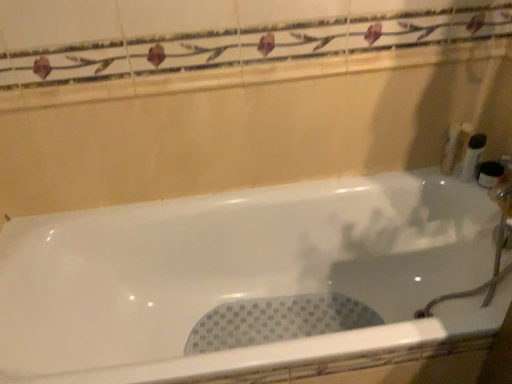
Question: Can we say white plastic container at right, the third toiletry in the right-to-left sequence, lies outside white plastic bottle at right, arranged as the 3th toiletry when viewed from the left?

Choices:
 (A) yes
 (B) no

Answer: (A)

Question: Is the position of white plastic container at right, the third toiletry in the right-to-left sequence, more distant than that of white plastic bottle at right, arranged as the 3th toiletry when viewed from the left?

Choices:
 (A) no
 (B) yes

Answer: (B)

Question: Considering the relative sizes of white plastic container at right, the 2th toiletry in the left-to-right sequence, and white plastic bottle at right, arranged as the 3th toiletry when viewed from the left, in the image provided, is white plastic container at right, the 2th toiletry in the left-to-right sequence, taller than white plastic bottle at right, arranged as the 3th toiletry when viewed from the left,?

Choices:
 (A) yes
 (B) no

Answer: (A)

Question: From a real-world perspective, is white plastic container at right, the third toiletry in the right-to-left sequence, beneath white plastic bottle at right, arranged as the 3th toiletry when viewed from the left?

Choices:
 (A) no
 (B) yes

Answer: (A)

Question: Can you confirm if white plastic container at right, the 2th toiletry in the left-to-right sequence, is wider than white plastic bottle at right, which is the second toiletry in right-to-left order?

Choices:
 (A) no
 (B) yes

Answer: (B)

Question: Considering their positions, is white glossy bathtub at center located in front of or behind white plastic bottle at right, arranged as the 3th toiletry when viewed from the left?

Choices:
 (A) behind
 (B) front

Answer: (B)

Question: Is point (165, 380) positioned closer to the camera than point (468, 147)?

Choices:
 (A) farther
 (B) closer

Answer: (B)

Question: From the image's perspective, is white glossy bathtub at center above or below white plastic bottle at right, which is the second toiletry in right-to-left order?

Choices:
 (A) above
 (B) below

Answer: (B)

Question: Considering the positions of white glossy bathtub at center and white plastic bottle at right, arranged as the 3th toiletry when viewed from the left, in the image, is white glossy bathtub at center taller or shorter than white plastic bottle at right, arranged as the 3th toiletry when viewed from the left,?

Choices:
 (A) tall
 (B) short

Answer: (A)

Question: In terms of height, does white plastic container at right, the third toiletry in the right-to-left sequence, look taller or shorter compared to white plastic bottle at right, which is the fourth toiletry from left to right?

Choices:
 (A) tall
 (B) short

Answer: (A)

Question: Relative to white plastic bottle at right, the 1th toiletry from the right, is white plastic container at right, the 2th toiletry in the left-to-right sequence, in front or behind?

Choices:
 (A) behind
 (B) front

Answer: (A)

Question: Considering the positions of white plastic container at right, the 2th toiletry in the left-to-right sequence, and white plastic bottle at right, which is the fourth toiletry from left to right, in the image, is white plastic container at right, the 2th toiletry in the left-to-right sequence, bigger or smaller than white plastic bottle at right, which is the fourth toiletry from left to right,?

Choices:
 (A) big
 (B) small

Answer: (A)

Question: Looking at their shapes, would you say white plastic container at right, the third toiletry in the right-to-left sequence, is wider or thinner than white plastic bottle at right, which is the fourth toiletry from left to right?

Choices:
 (A) thin
 (B) wide

Answer: (B)

Question: Considering the positions of white plastic bottle at right, arranged as the 3th toiletry when viewed from the left, and white plastic bottle at right, the fourth toiletry from the right, in the image, is white plastic bottle at right, arranged as the 3th toiletry when viewed from the left, wider or thinner than white plastic bottle at right, the fourth toiletry from the right,?

Choices:
 (A) wide
 (B) thin

Answer: (B)

Question: From the image's perspective, is white plastic bottle at right, which is the second toiletry in right-to-left order, located above or below white plastic bottle at right, placed as the 1th toiletry when sorted from left to right?

Choices:
 (A) above
 (B) below

Answer: (B)